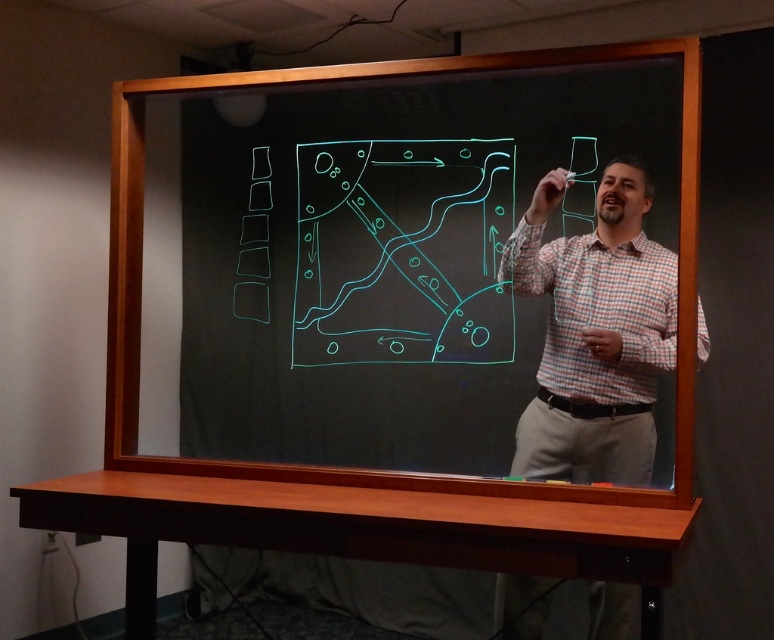
Is blackboard at center smaller than plaid shirt at center?

Actually, blackboard at center might be larger than plaid shirt at center.

Who is shorter, blackboard at center or plaid shirt at center?

plaid shirt at center is shorter.

Is point (502, 221) less distant than point (611, 387)?

No, it is not.

I want to click on blackboard at center, so click(420, 268).